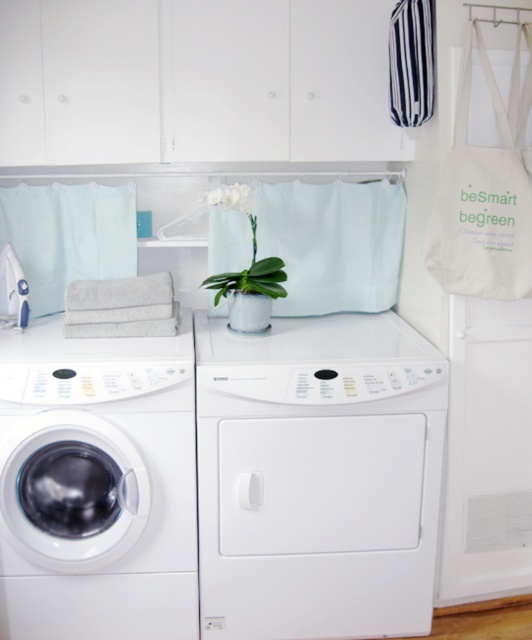
Question: Which point is closer to the camera?

Choices:
 (A) (115, 317)
 (B) (311, 326)

Answer: (A)

Question: Does white matte dryer at center appear over blue and white striped fabric at upper right?

Choices:
 (A) no
 (B) yes

Answer: (A)

Question: Which object is positioned closest to the white matte dryer at center?

Choices:
 (A) gray cotton towels at left
 (B) green matte orchid at center

Answer: (A)

Question: Is gray cotton towels at left in front of blue and white striped fabric at upper right?

Choices:
 (A) yes
 (B) no

Answer: (B)

Question: Does blue and white striped fabric at upper right have a lesser width compared to green matte orchid at center?

Choices:
 (A) no
 (B) yes

Answer: (B)

Question: Among these objects, which one is nearest to the camera?

Choices:
 (A) gray cotton towels at left
 (B) white matte dryer at center
 (C) white glossy washing machine at left
 (D) blue and white striped fabric at upper right

Answer: (C)